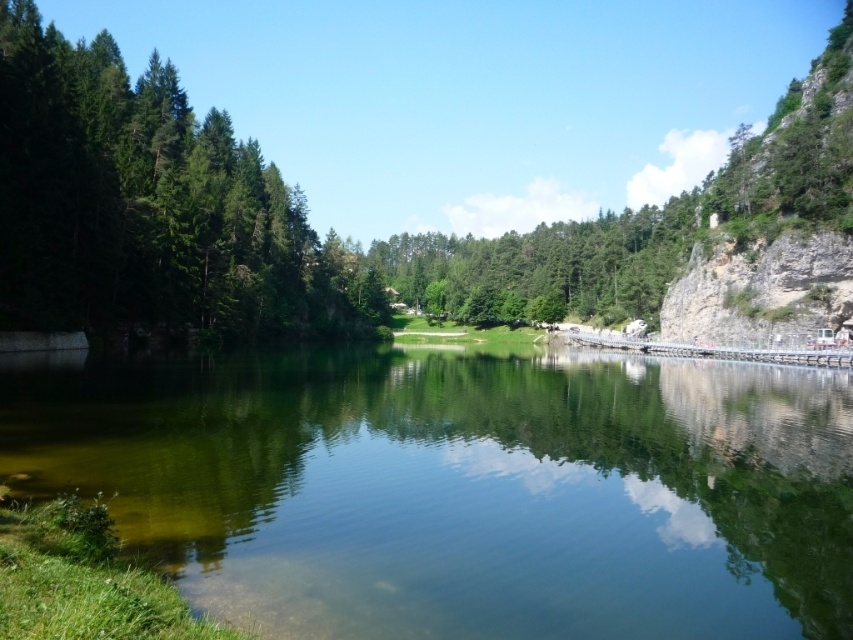
You are standing at the edge of the green reflective water at center and want to walk towards the green matte tree at center. Which direction should you head?

You should head to the right side because the green reflective water at center is positioned on the left side of the green matte tree at center, meaning the tree is to your right.

You are standing at the center of the image and want to locate the green reflective water at center. Which direction should you look to find it?

You should look directly ahead because the green reflective water at center is located at the center of the image.